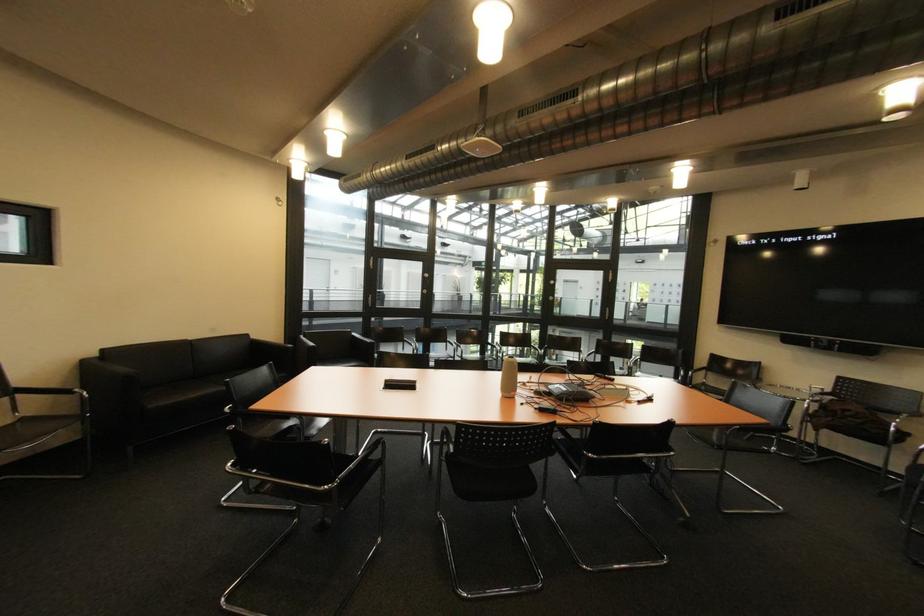
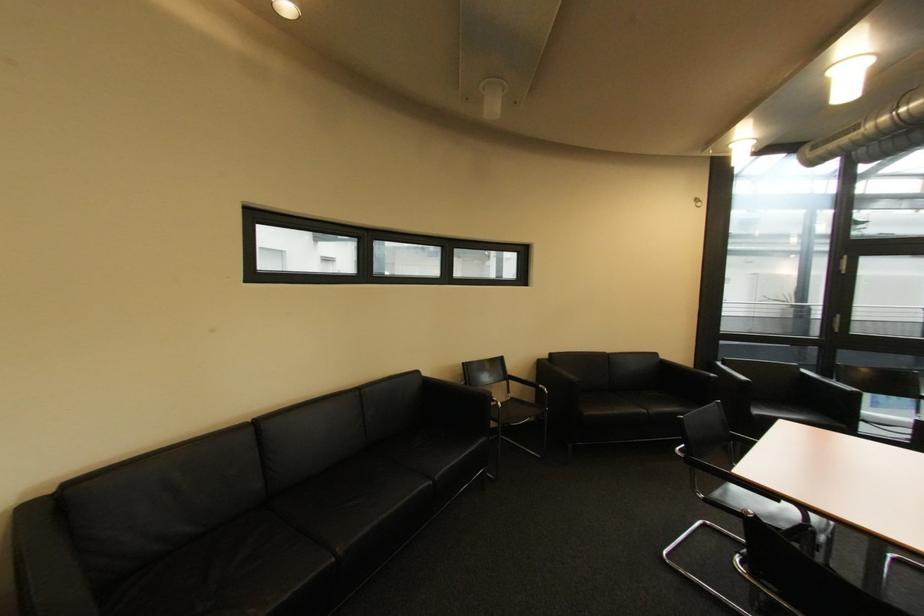
The point at (236, 408) is marked in the first image. Where is the corresponding point in the second image?

(686, 450)